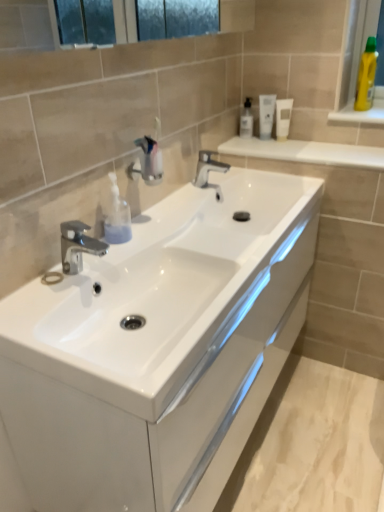
Where is `free space in front of white glossy tube at upper right, which ranks as the 2th mouthwash in right-to-left order`? free space in front of white glossy tube at upper right, which ranks as the 2th mouthwash in right-to-left order is located at coordinates (276, 147).